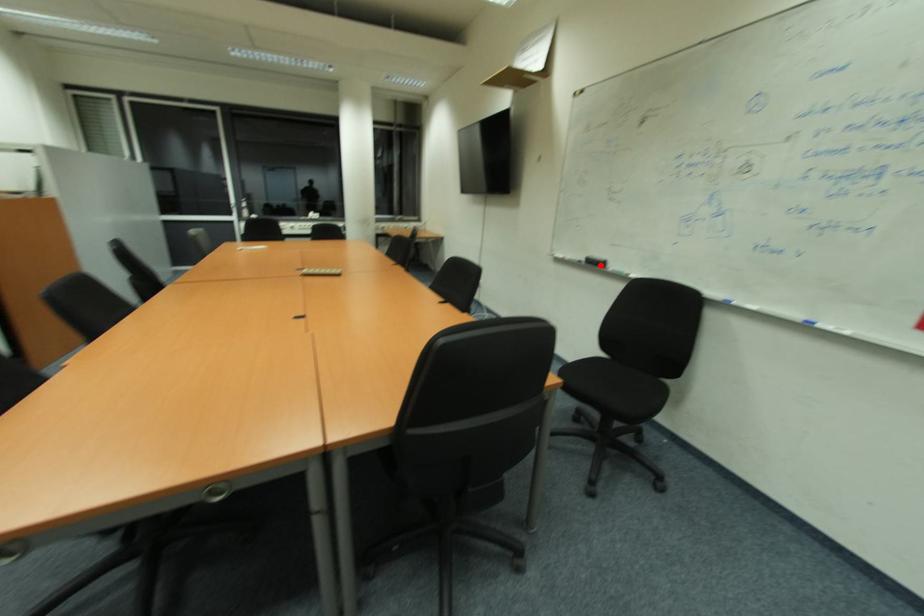
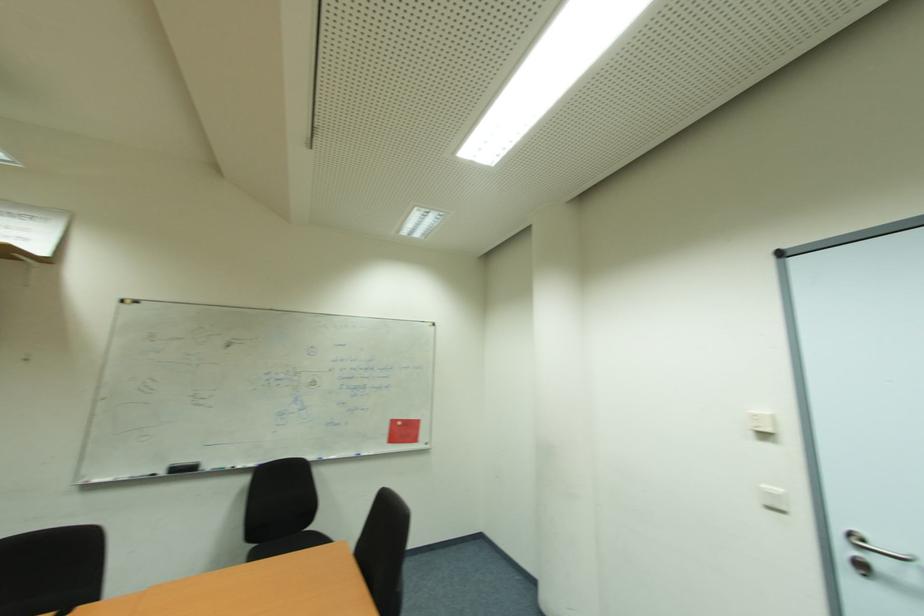
Find the pixel in the second image that matches the highlighted location in the first image.

(189, 469)